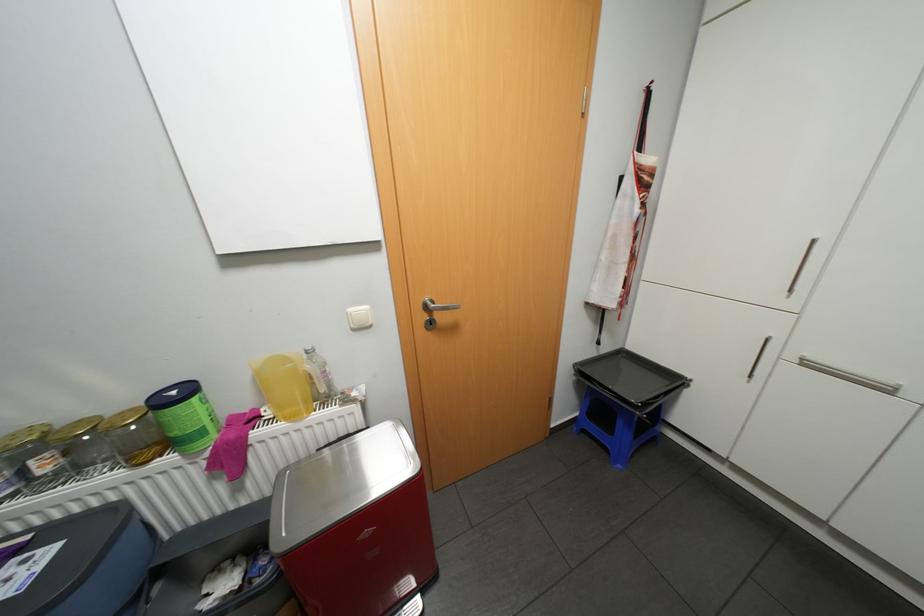
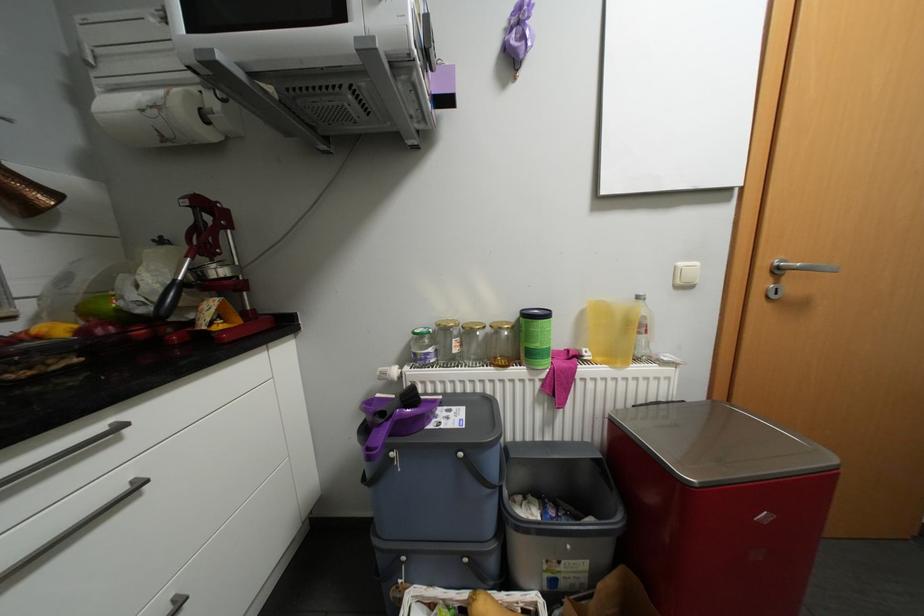
Question: The images are taken continuously from a first-person perspective. In which direction are you moving?

Choices:
 (A) Left
 (B) Right
 (C) Forward
 (D) Backward

Answer: (A)